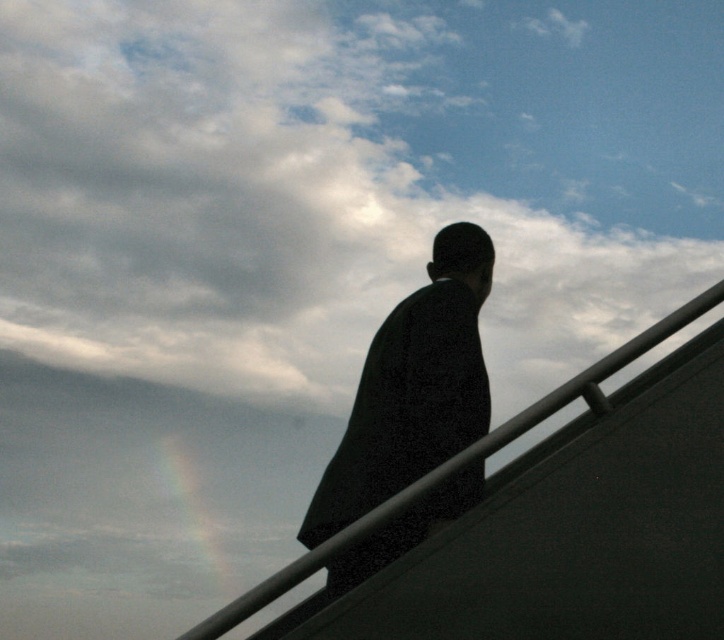
Does cloudy sky at upper center appear on the right side of black matte suit at center?

No, cloudy sky at upper center is not to the right of black matte suit at center.

Is point (88, 96) positioned in front of point (329, 592)?

That is False.

This screenshot has width=724, height=640. In order to click on cloudy sky at upper center in this screenshot , I will do `click(348, 180)`.